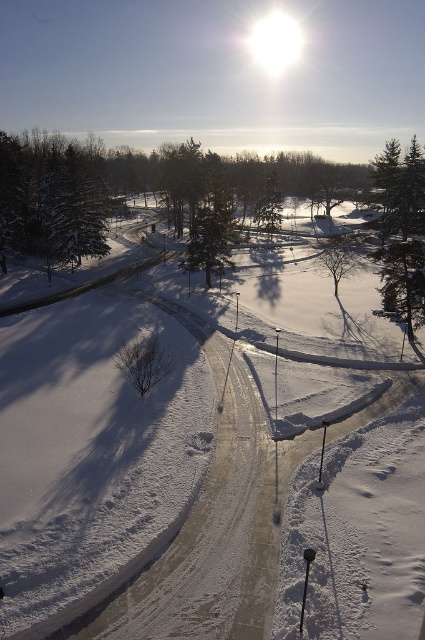
Question: Which point is closer to the camera taking this photo?

Choices:
 (A) (110, 476)
 (B) (385, 218)

Answer: (A)

Question: Considering the relative positions of white snow at center and green textured pine tree at right in the image provided, where is white snow at center located with respect to green textured pine tree at right?

Choices:
 (A) above
 (B) below

Answer: (B)

Question: Can you confirm if white snow at center is positioned to the right of green textured pine tree at right?

Choices:
 (A) no
 (B) yes

Answer: (A)

Question: Is white snow at center below green textured pine tree at right?

Choices:
 (A) no
 (B) yes

Answer: (B)